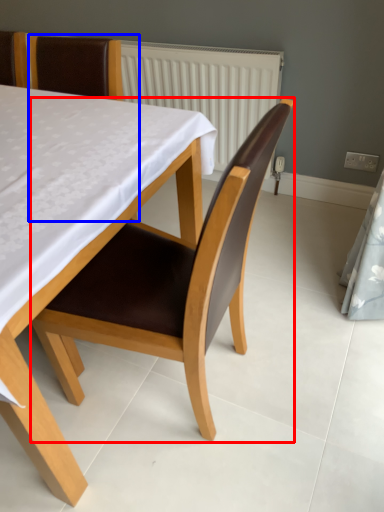
Question: Which point is further to the camera, chair (highlighted by a red box) or chair (highlighted by a blue box)?

Choices:
 (A) chair
 (B) chair

Answer: (B)